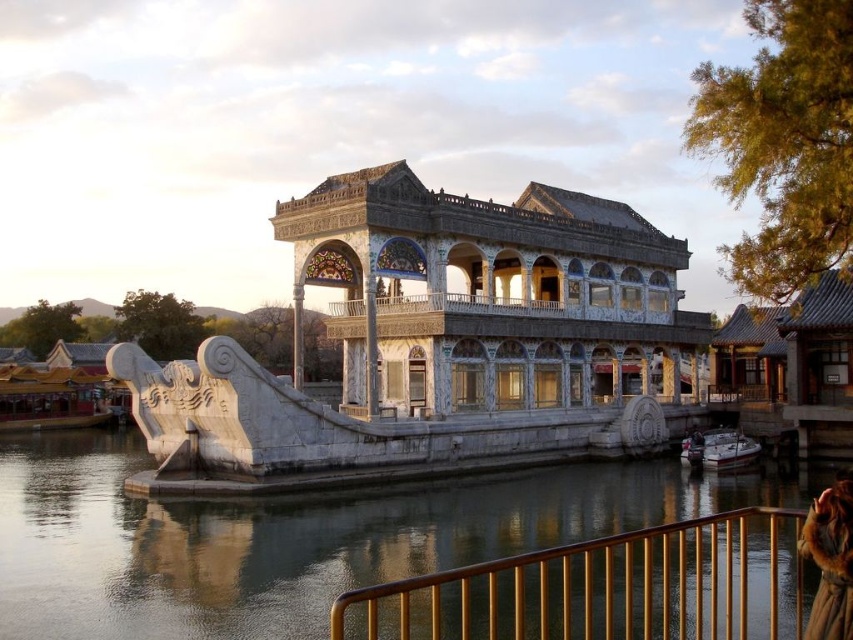
Is smooth gray water at lower center behind white marble palace at center?

No, it is in front of white marble palace at center.

Is point (509, 506) closer to viewer compared to point (370, 202)?

No, (509, 506) is behind (370, 202).

Identify the location of smooth gray water at lower center. Image resolution: width=853 pixels, height=640 pixels. (292, 538).

Consider the image. Between smooth gray water at lower center and white glossy boat at lower right, which one has less height?

With less height is white glossy boat at lower right.

Is smooth gray water at lower center to the right of white glossy boat at lower right from the viewer's perspective?

In fact, smooth gray water at lower center is to the left of white glossy boat at lower right.

Is point (318, 540) less distant than point (691, 440)?

Yes, it is.

Where is `smooth gray water at lower center`? smooth gray water at lower center is located at coordinates (292, 538).

Between point (152, 538) and point (850, 483), which one is positioned in front?

Point (850, 483) is more forward.

Is smooth gray water at lower center thinner than fuzzy brown fur coat at lower right?

Incorrect, smooth gray water at lower center's width is not less than fuzzy brown fur coat at lower right's.

Does point (370, 529) come closer to viewer compared to point (809, 621)?

No, (370, 529) is further to viewer.

At what (x,y) coordinates should I click in order to perform the action: click on smooth gray water at lower center. Please return your answer as a coordinate pair (x, y). The height and width of the screenshot is (640, 853). Looking at the image, I should click on (292, 538).